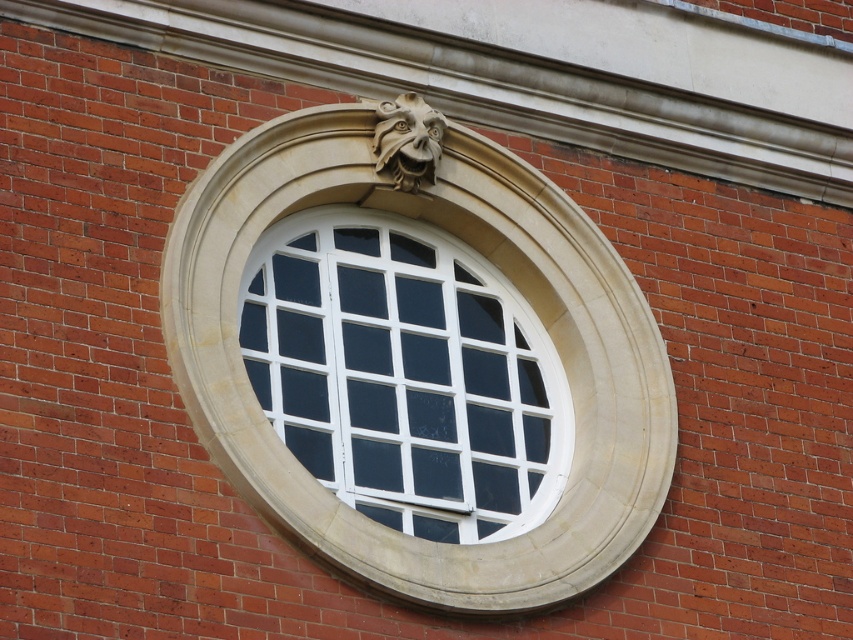
Question: Observing the image, what is the correct spatial positioning of white glass window at center in reference to polished stone lion head at upper center?

Choices:
 (A) left
 (B) right

Answer: (B)

Question: Which of the following is the farthest from the observer?

Choices:
 (A) white stone window frame at center
 (B) polished stone lion head at upper center
 (C) white glass window at center

Answer: (C)

Question: Which object is the farthest from the polished stone lion head at upper center?

Choices:
 (A) white glass window at center
 (B) white stone window frame at center

Answer: (A)

Question: Which of the following is the closest to the observer?

Choices:
 (A) white glass window at center
 (B) polished stone lion head at upper center

Answer: (B)

Question: Is white glass window at center positioned in front of polished stone lion head at upper center?

Choices:
 (A) no
 (B) yes

Answer: (A)

Question: Can you confirm if white stone window frame at center is positioned to the right of polished stone lion head at upper center?

Choices:
 (A) no
 (B) yes

Answer: (B)